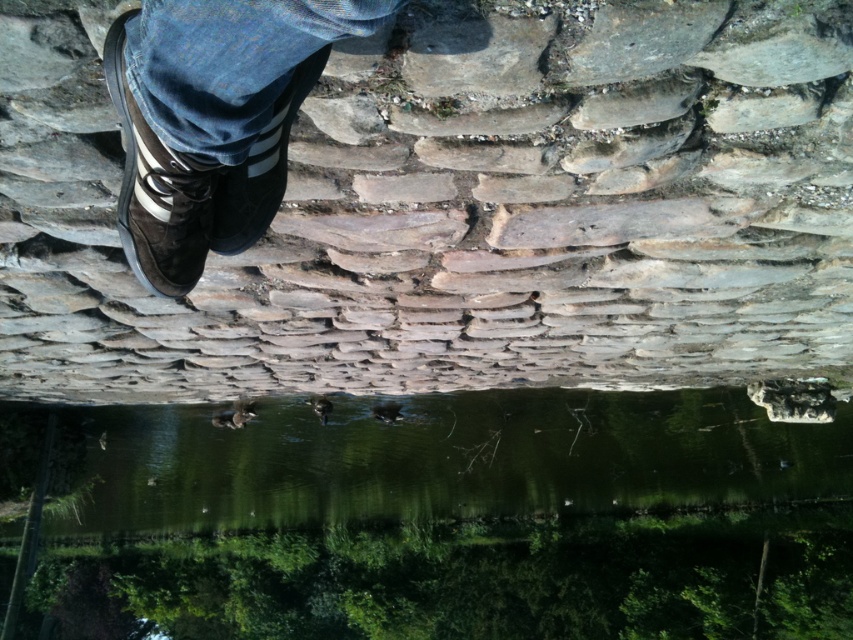
Does blue denim jeans at upper left have a larger size compared to matte black shoe at upper left?

No, blue denim jeans at upper left is not bigger than matte black shoe at upper left.

Is blue denim jeans at upper left smaller than matte black shoe at upper left?

Indeed, blue denim jeans at upper left has a smaller size compared to matte black shoe at upper left.

Which is in front, point (231, 42) or point (239, 188)?

Point (231, 42)

Locate an element on the screen. Image resolution: width=853 pixels, height=640 pixels. blue denim jeans at upper left is located at coordinates (229, 61).

Which is below, brown stone wall at upper center or green reflective water at center?

green reflective water at center

Between point (718, 276) and point (614, 483), which one is positioned in front?

Point (718, 276)

Is point (302, 362) positioned after point (664, 432)?

No, it is in front of (664, 432).

I want to click on brown stone wall at upper center, so click(x=460, y=209).

Is green reflective water at center above matte black shoe at upper left?

Incorrect, green reflective water at center is not positioned above matte black shoe at upper left.

Does green reflective water at center have a greater width compared to matte black shoe at upper left?

Yes, green reflective water at center is wider than matte black shoe at upper left.

Is point (746, 630) closer to camera compared to point (235, 177)?

No, it is not.

Where is `green reflective water at center`? Image resolution: width=853 pixels, height=640 pixels. green reflective water at center is located at coordinates (448, 520).